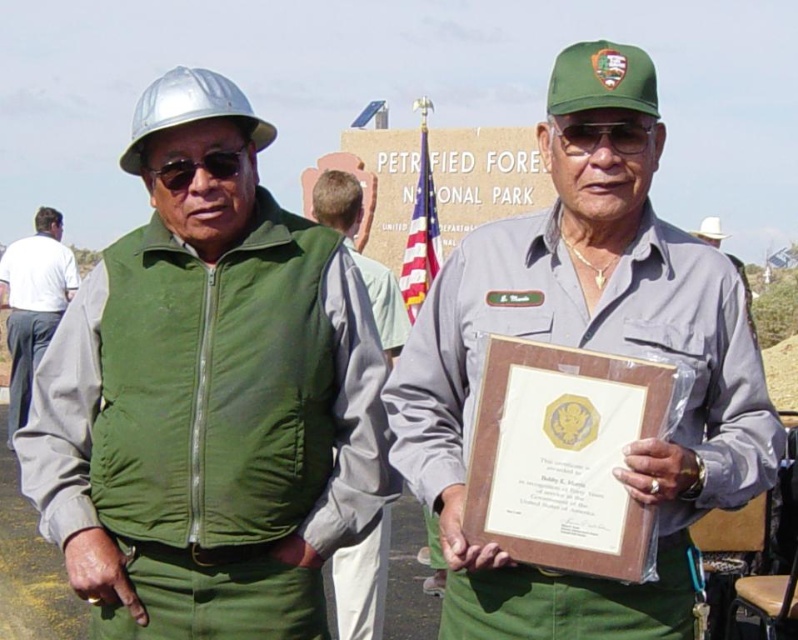
Between white cotton shirt at left and glossy plastic goggles at center, which one has less height?

glossy plastic goggles at center is shorter.

Who is lower down, white cotton shirt at left or glossy plastic goggles at center?

white cotton shirt at left

Image resolution: width=798 pixels, height=640 pixels. What do you see at coordinates (34, 304) in the screenshot? I see `white cotton shirt at left` at bounding box center [34, 304].

The width and height of the screenshot is (798, 640). Find the location of `white cotton shirt at left`. white cotton shirt at left is located at coordinates (34, 304).

Is green matte vest at center taller than green fabric vest at center?

No, green matte vest at center is not taller than green fabric vest at center.

Which is in front, point (36, 406) or point (360, 200)?

Positioned in front is point (36, 406).

This screenshot has height=640, width=798. I want to click on green matte vest at center, so click(x=208, y=400).

Is green fabric vest at center smaller than american flag at center?

No, green fabric vest at center is not smaller than american flag at center.

Between green fabric vest at center and american flag at center, which one appears on the left side from the viewer's perspective?

green fabric vest at center is more to the left.

Between point (399, 305) and point (427, 168), which one is positioned in front?

Point (399, 305)

Image resolution: width=798 pixels, height=640 pixels. I want to click on green fabric vest at center, so click(361, 253).